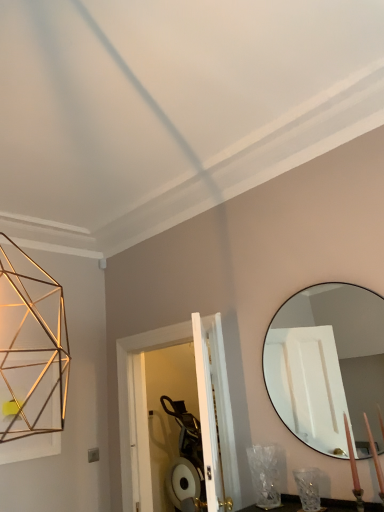
Question: Can you confirm if matte black mirror at right is wider than candle at lower right?

Choices:
 (A) yes
 (B) no

Answer: (B)

Question: Would you say matte black mirror at right is a long distance from candle at lower right?

Choices:
 (A) no
 (B) yes

Answer: (A)

Question: Is matte black mirror at right not within candle at lower right?

Choices:
 (A) yes
 (B) no

Answer: (A)

Question: Does matte black mirror at right have a lesser width compared to candle at lower right?

Choices:
 (A) no
 (B) yes

Answer: (B)

Question: Is matte black mirror at right touching candle at lower right?

Choices:
 (A) yes
 (B) no

Answer: (B)

Question: Is matte black mirror at right aimed at candle at lower right?

Choices:
 (A) no
 (B) yes

Answer: (B)

Question: From the image's perspective, is clear glass vase at lower right above candle at lower right?

Choices:
 (A) no
 (B) yes

Answer: (A)

Question: Is clear glass vase at lower right touching candle at lower right?

Choices:
 (A) yes
 (B) no

Answer: (B)

Question: Would you say clear glass vase at lower right is a long distance from candle at lower right?

Choices:
 (A) no
 (B) yes

Answer: (A)

Question: Is clear glass vase at lower right further to the viewer compared to candle at lower right?

Choices:
 (A) yes
 (B) no

Answer: (A)

Question: Is clear glass vase at lower right facing away from candle at lower right?

Choices:
 (A) yes
 (B) no

Answer: (B)

Question: From a real-world perspective, is clear glass vase at lower right over candle at lower right?

Choices:
 (A) yes
 (B) no

Answer: (B)

Question: Considering the relative sizes of candle at lower right and matte black mirror at right in the image provided, is candle at lower right smaller than matte black mirror at right?

Choices:
 (A) no
 (B) yes

Answer: (B)